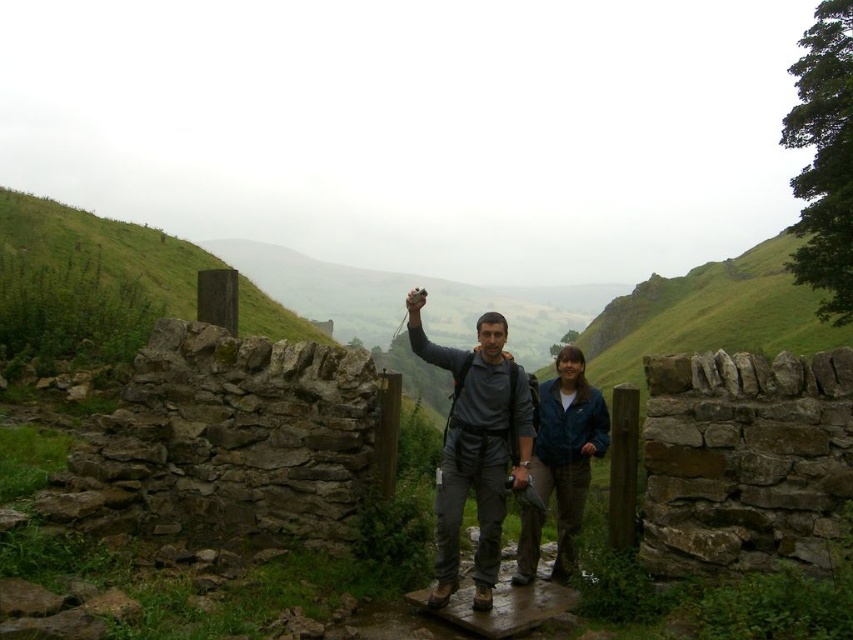
You are a painter who wants to paint the scene. You have a canvas that can only fit objects up to 3 meters wide. You see the green grass at upper left and the blue fabric jacket at center. Can you fit both on your canvas if they are placed side by side?

The green grass at upper left might be wider than blue fabric jacket at center. Since the total width could exceed 3 meters, it depends on their combined width. Without exact measurements, it is uncertain if they will fit together on the canvas.

You are a hiker who just arrived at this location. You have a matte gray backpack at center and a blue fabric jacket at center with you. To access your jacket quickly, which item should you remove first?

The matte gray backpack at center is located above blue fabric jacket at center, so you should remove the matte gray backpack at center first to access the blue fabric jacket at center.

You are planning to place a new bench in the rural outdoor scene. The bench requires a space that is wider than the matte gray backpack at center but narrower than the green grass at upper left. Is there a suitable spot between these two objects to place the bench?

The matte gray backpack at center is thinner than the green grass at upper left. Therefore, there is a suitable spot between them where the bench can be placed as it requires a width between their dimensions.